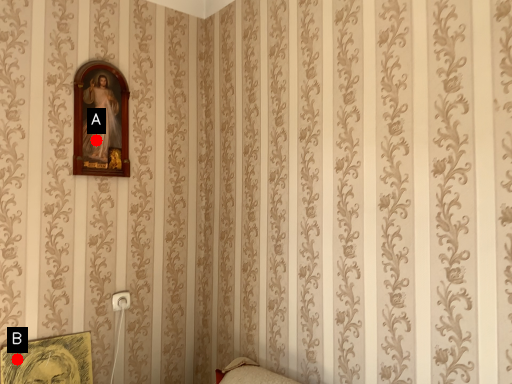
Question: Two points are circled on the image, labeled by A and B beside each circle. Which of the following is the farthest from the observer?

Choices:
 (A) A is further
 (B) B is further

Answer: (A)